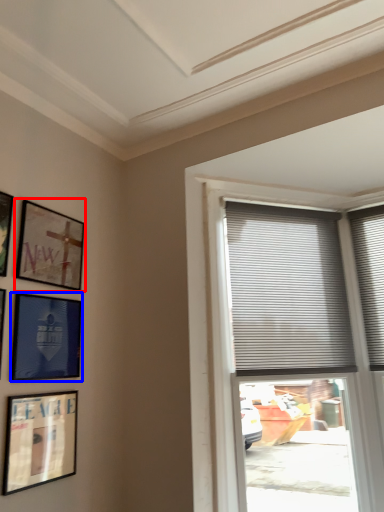
Question: Which of the following is the farthest to the observer, picture frame (highlighted by a red box) or picture frame (highlighted by a blue box)?

Choices:
 (A) picture frame
 (B) picture frame

Answer: (A)